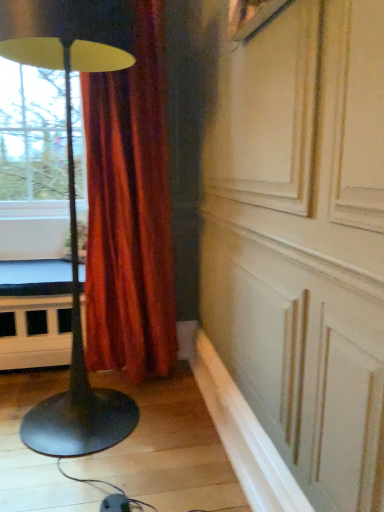
The width and height of the screenshot is (384, 512). Find the location of `vacant space to the right of black matte floor lamp at left`. vacant space to the right of black matte floor lamp at left is located at coordinates (188, 437).